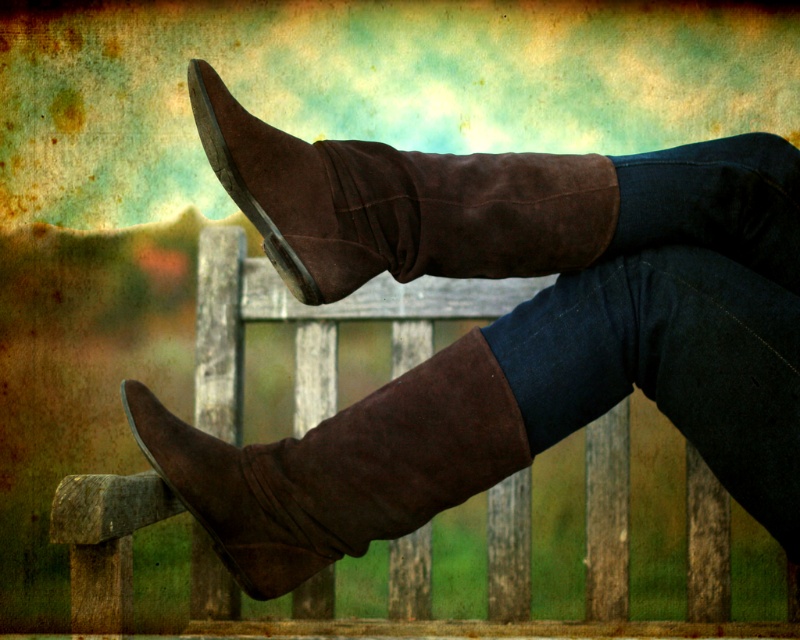
Question: Is suede boot at center positioned behind suede brown boot at center?

Choices:
 (A) no
 (B) yes

Answer: (A)

Question: Can you confirm if suede boots at center is wider than suede boot at center?

Choices:
 (A) yes
 (B) no

Answer: (A)

Question: Which of these objects is positioned farthest from the suede boots at center?

Choices:
 (A) suede brown boot at center
 (B) suede boot at center

Answer: (B)

Question: Estimate the real-world distances between objects in this image. Which object is closer to the suede boots at center?

Choices:
 (A) suede boot at center
 (B) suede brown boot at center

Answer: (B)

Question: Is suede boots at center above suede brown boot at center?

Choices:
 (A) no
 (B) yes

Answer: (B)

Question: Which is nearer to the suede brown boot at center?

Choices:
 (A) suede boot at center
 (B) suede boots at center

Answer: (B)